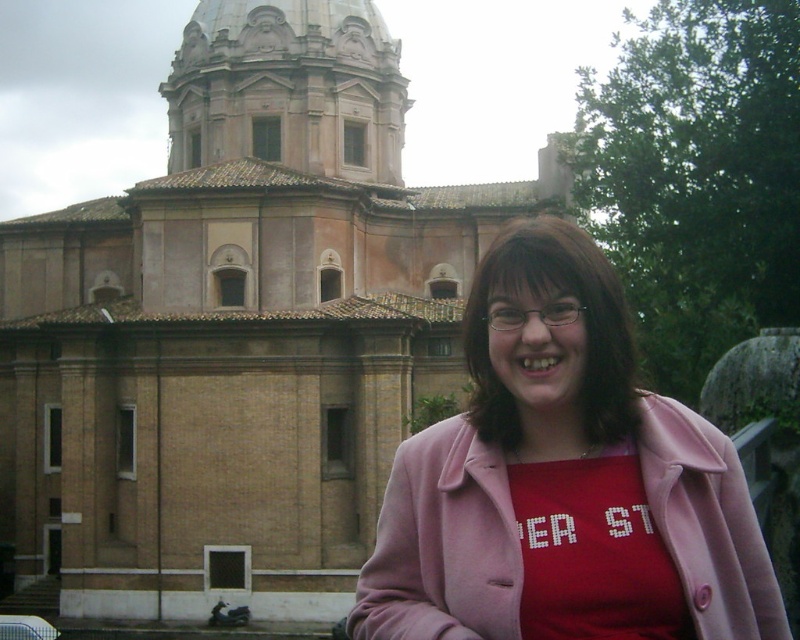
You are a photographer trying to capture the beige stone church at center and the pink fabric at center in a single photo. Considering their heights, which object will appear taller in the photo?

The beige stone church at center will appear taller in the photo since it has a greater height compared to the pink fabric at center.

You are standing at point (532, 362) and want to walk to the historic building in the scene. Is the point (214, 244) between you and the building?

Yes, the point (214, 244) is between you and the building because it is behind point (532, 362) where you are standing.

You are a tourist standing in front of the beige stone church at center and the pink fabric at center. Which object is located more to the left?

The beige stone church at center is positioned on the left side of the pink fabric at center, so it is more to the left.